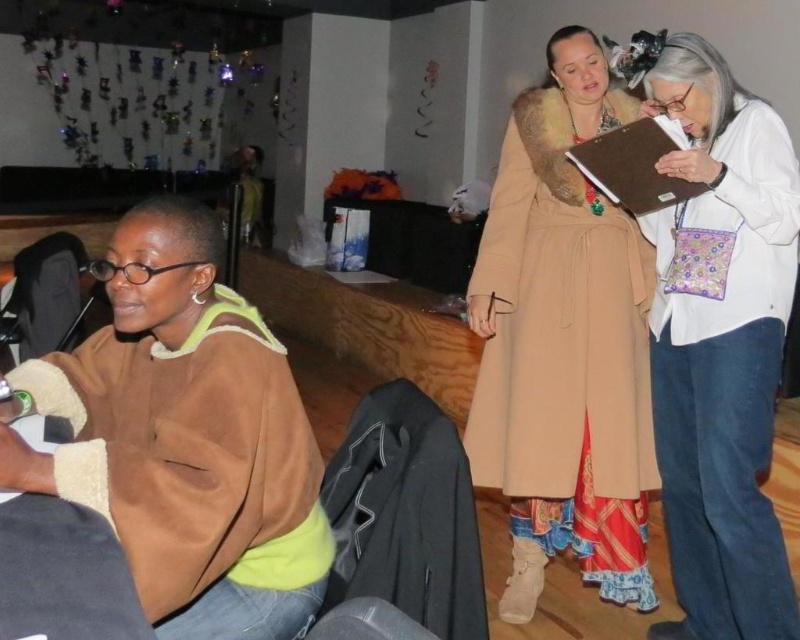
You are a delivery robot with a width of 0.8 meters. You need to move from the suede brown sweater at lower left to the beige wool coat at center. Can you pass through the space between them without moving any objects?

The distance between the suede brown sweater at lower left and the beige wool coat at center is 1.07 meters. Since your width is 0.8 meters, you can pass through the space between them without moving any objects.

You are organizing a charity clothing drive and need to pack items into boxes. The box you have can only fit items that are smaller than the beige wool coat at center. Can the suede brown sweater at lower left be placed into this box?

The suede brown sweater at lower left has a smaller size compared to beige wool coat at center, so yes, it can be placed into the box since it is smaller than the beige wool coat at center.

You are organizing a small event and need to place a 15 cm tall decorative item on either the white cotton purse at right or the brown paper clipboard at upper right. Which object can accommodate the item based on their height?

The white cotton purse at right is taller than the brown paper clipboard at upper right, so the decorative item can be placed on the white cotton purse at right.